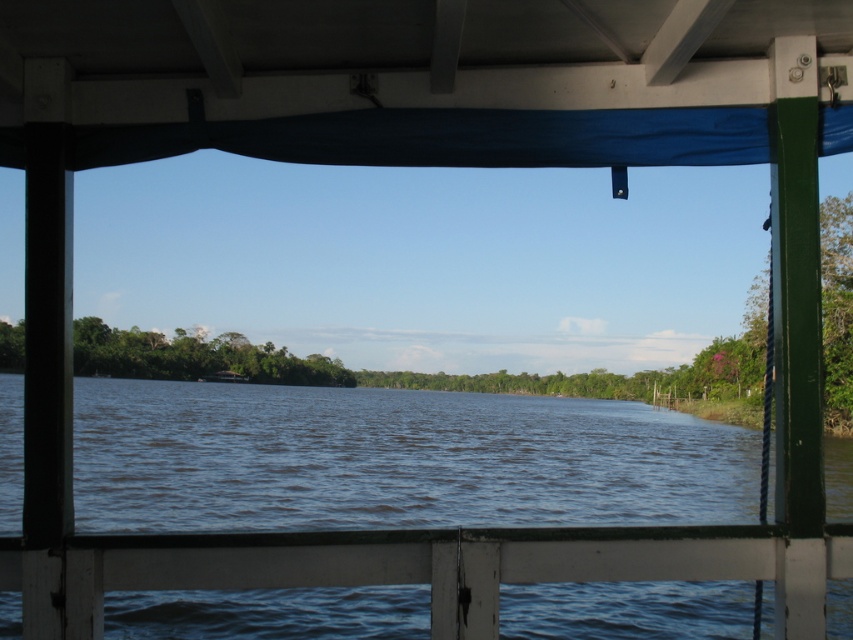
You are standing on the wooden structure and looking down. You see the blue water at center and the white painted wood rail at lower center. Which object is higher from the ground?

The blue water at center is taller than the white painted wood rail at lower center, so the blue water at center is higher from the ground.

You are standing under the wooden structure in the riverside scene. Where is the blue water at center located in terms of its 2D coordinates?

The blue water at center is located at the 2D coordinates of point (393, 460).